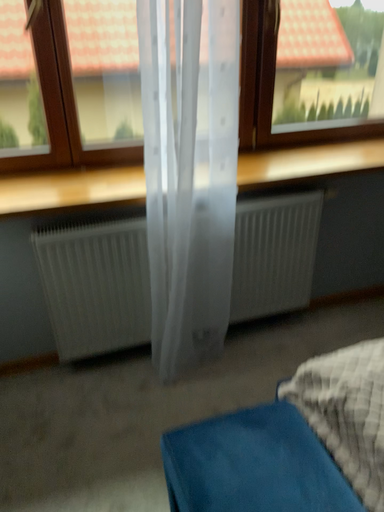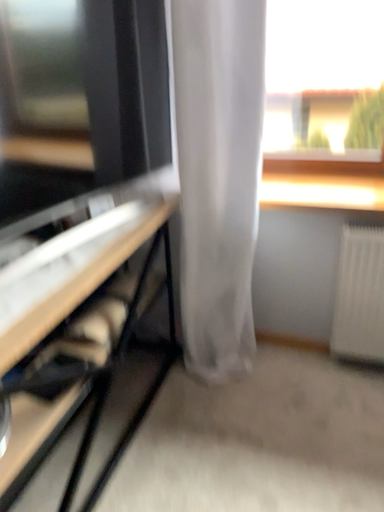
Question: How did the camera likely rotate when shooting the video?

Choices:
 (A) rotated left
 (B) rotated right

Answer: (A)